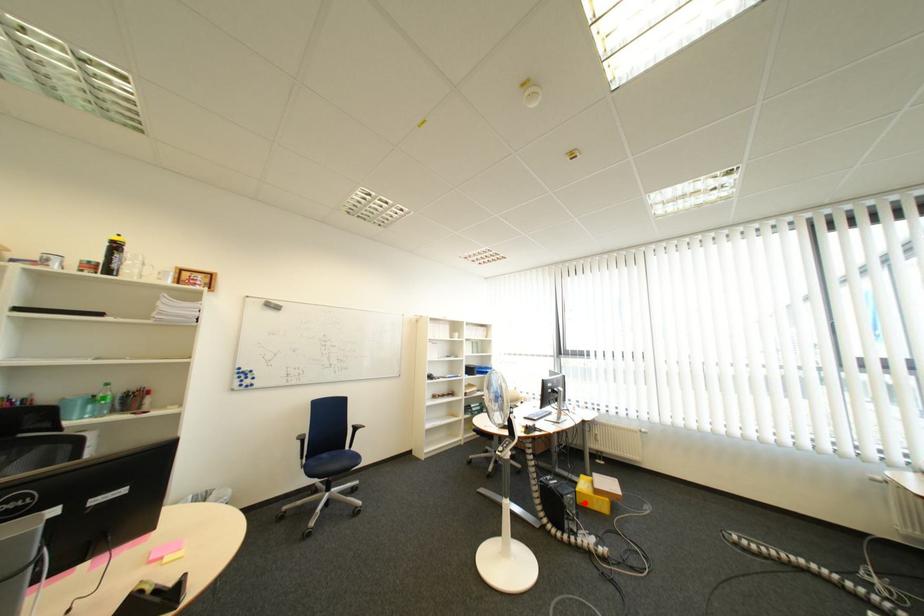
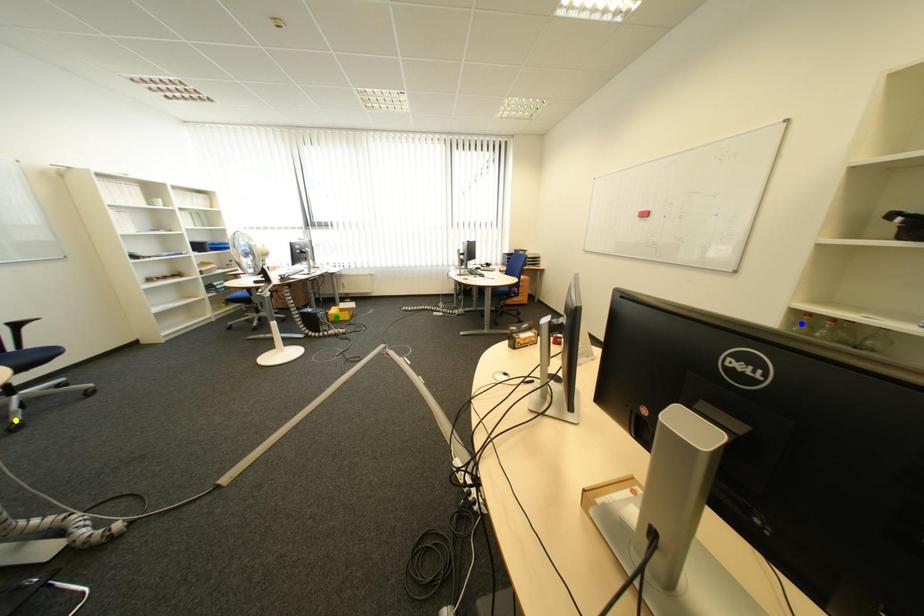
Question: I am providing you with two images of the same scene from different viewpoints. A red point is marked on the first image. You are given multiple points on the second image. Can you choose the point in image 2 that corresponds to the point in image 1?

Choices:
 (A) blue point
 (B) yellow point
 (C) green point

Answer: (C)